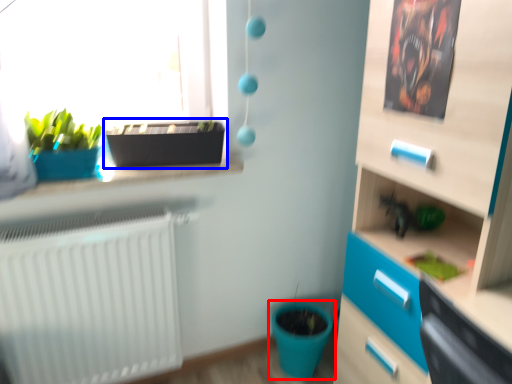
Question: Which object appears farthest to the camera in this image, flowerpot (highlighted by a red box) or flowerpot (highlighted by a blue box)?

Choices:
 (A) flowerpot
 (B) flowerpot

Answer: (A)